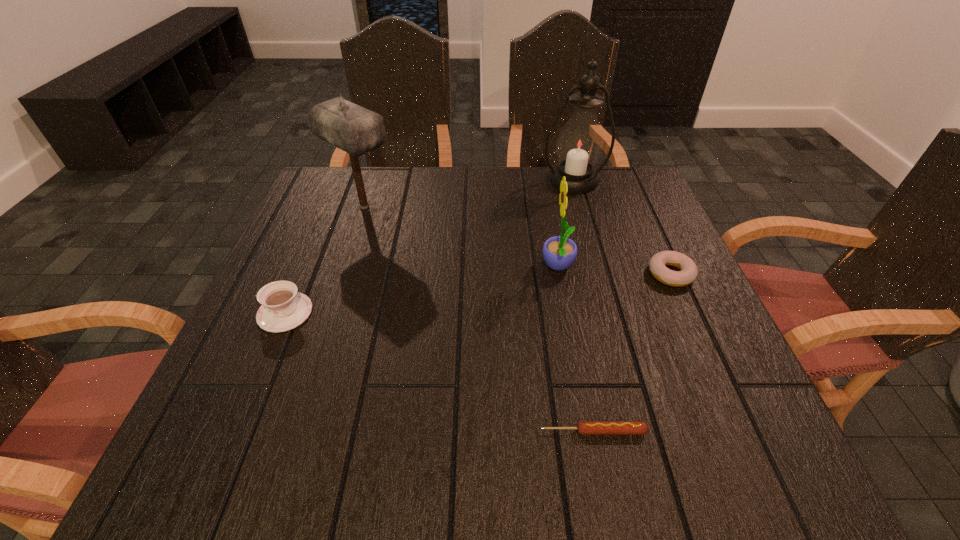
Locate an element on the screen. The width and height of the screenshot is (960, 540). teacup at the left edge is located at coordinates (283, 308).

I want to click on oil lamp present at the right edge, so click(x=580, y=142).

This screenshot has height=540, width=960. In order to click on doughnut positioned at the right edge in this screenshot , I will do `click(688, 272)`.

Locate an element on the screen. Image resolution: width=960 pixels, height=540 pixels. object present at the far left corner is located at coordinates (356, 130).

Where is `object that is at the far right corner`? object that is at the far right corner is located at coordinates (580, 142).

Where is `vacant region at the far edge of the desktop`? The height and width of the screenshot is (540, 960). vacant region at the far edge of the desktop is located at coordinates (387, 191).

At what (x,y) coordinates should I click in order to perform the action: click on vacant space at the near edge of the desktop. Please return your answer as a coordinate pair (x, y). This screenshot has height=540, width=960. Looking at the image, I should click on (374, 431).

In the image, there is a desktop. At what (x,y) coordinates should I click in order to perform the action: click on vacant region at the left edge. Please return your answer as a coordinate pair (x, y). Looking at the image, I should click on (263, 351).

The height and width of the screenshot is (540, 960). I want to click on free point at the right edge, so (709, 367).

What are the coordinates of `vacant space at the far left corner` in the screenshot? It's located at (342, 166).